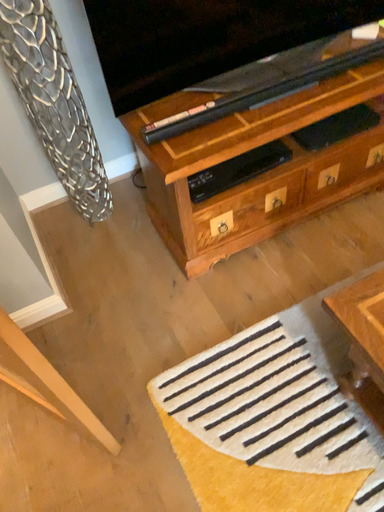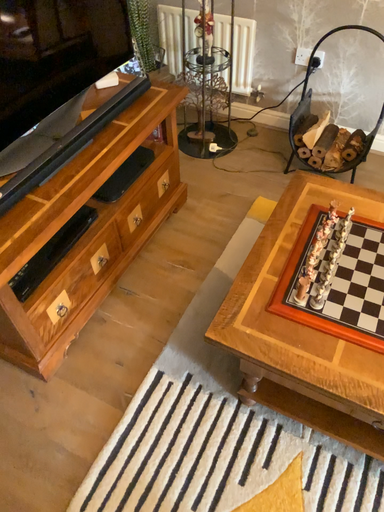
Question: Which way did the camera rotate in the video?

Choices:
 (A) rotated downward
 (B) rotated upward

Answer: (B)